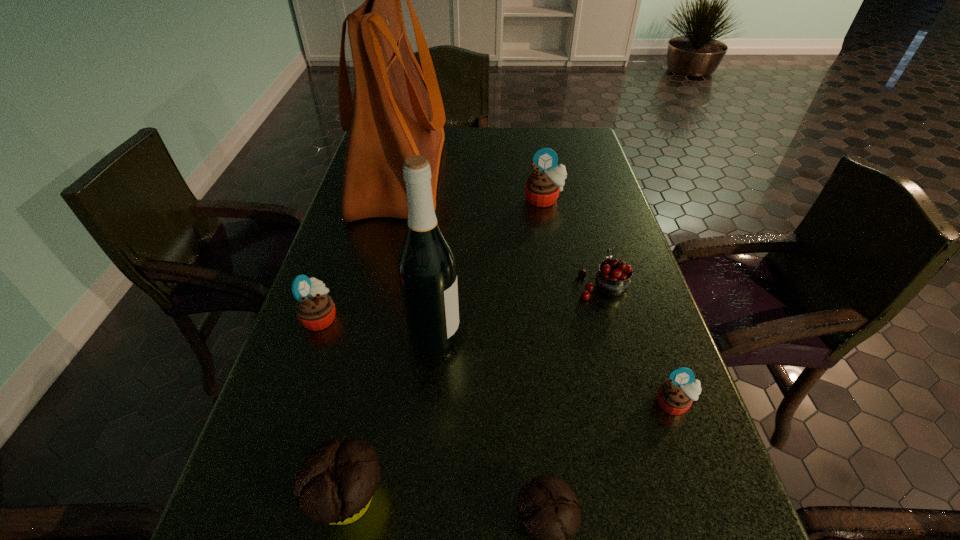
Identify the location of vacant area that lies between the third nearest muffin and the cherry. Image resolution: width=960 pixels, height=540 pixels. (637, 343).

In order to click on free space between the smallest pink muffin and the second smallest pink muffin in this screenshot , I will do `click(497, 360)`.

The image size is (960, 540). In order to click on empty space between the shopping bag and the farthest pink muffin in this screenshot , I will do (472, 187).

Locate an element on the screen. The width and height of the screenshot is (960, 540). object that is the fourth closest to the second nearest pink muffin is located at coordinates (548, 507).

Identify which object is the fifth closest to the dark wine bottle. Please provide its 2D coordinates. Your answer should be formatted as a tuple, i.e. [(x, y)], where the tuple contains the x and y coordinates of a point satisfying the conditions above.

[(396, 112)]

I want to click on muffin that is the nearest to the second farthest muffin, so click(335, 483).

Identify which muffin is the closest to the smaller chocolate muffin. Please provide its 2D coordinates. Your answer should be formatted as a tuple, i.e. [(x, y)], where the tuple contains the x and y coordinates of a point satisfying the conditions above.

[(335, 483)]

Identify the location of pink muffin that is the second nearest to the farthest muffin. The width and height of the screenshot is (960, 540). (675, 396).

Point out which pink muffin is positioned as the second nearest to the third tallest object. Please provide its 2D coordinates. Your answer should be formatted as a tuple, i.e. [(x, y)], where the tuple contains the x and y coordinates of a point satisfying the conditions above.

[(675, 396)]

The width and height of the screenshot is (960, 540). I want to click on vacant point that satisfies the following two spatial constraints: 1. on the front-facing side of the second pink muffin from right to left; 2. on the front-facing side of the leftmost muffin, so click(x=565, y=317).